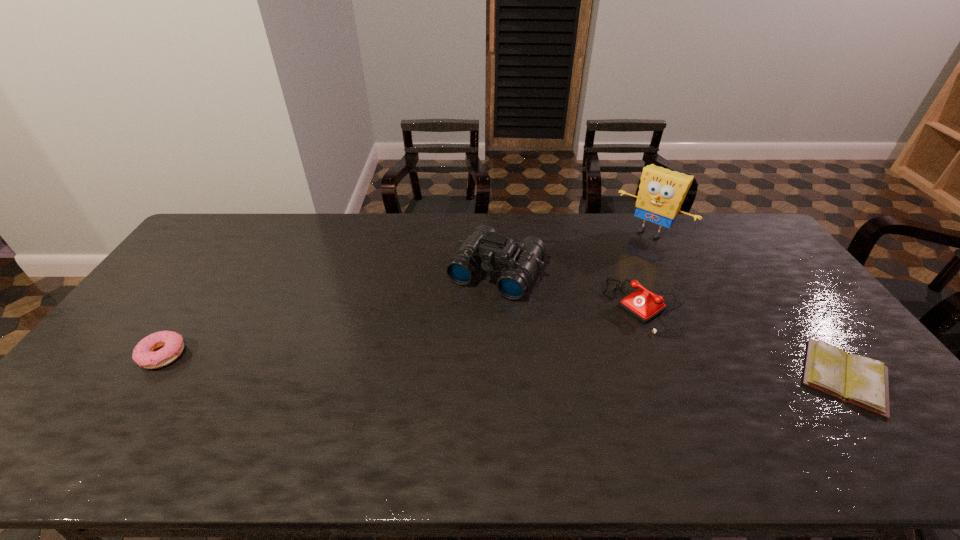
You are a GUI agent. You are given a task and a screenshot of the screen. Output one action in this format:
    pyautogui.click(x=<x>, y=<y>)
    Task: Click on the vacant spot on the desktop that is between the leftmost object and the rightmost object and is positioned on the dial of the third shortest object
    The image size is (960, 540).
    Given the screenshot: What is the action you would take?
    pyautogui.click(x=556, y=367)

I want to click on vacant spot on the desktop that is between the fourth tallest object and the rightmost object and is positioned through the lenses of the binoculars, so click(x=440, y=363).

Find the location of a particular element. vacant space on the desktop that is between the second shortest object and the rightmost object and is positioned on the face of the tallest object is located at coordinates (539, 367).